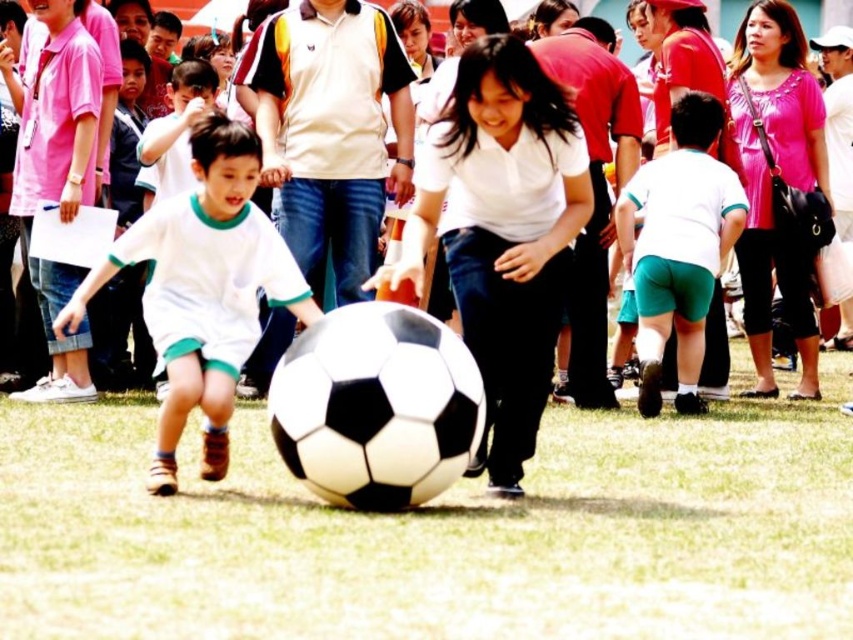
You are a photographer standing at the edge of the soccer field. You want to take a closeup photo of the white matte soccer ball at lower left. Considering the distance, can you get a clear closeup shot without moving closer?

The white matte soccer ball at lower left is 164.67 feet away from the camera. Since this distance is quite far, you would need a zoom lens with sufficient reach to capture a clear closeup without moving closer.